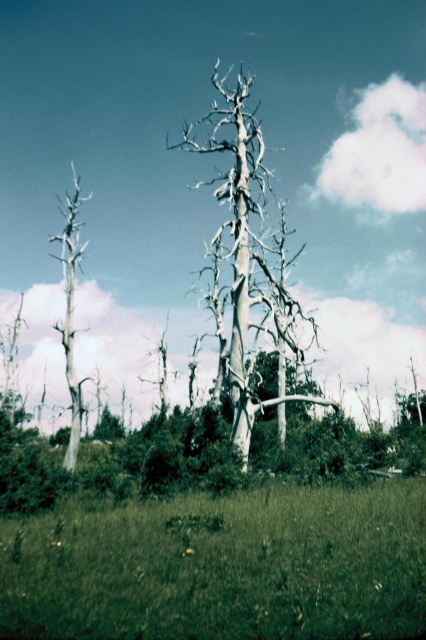
Question: Does green grass at lower center appear under white textured tree at center?

Choices:
 (A) no
 (B) yes

Answer: (B)

Question: Based on their relative distances, which object is farther from the green grass at lower center?

Choices:
 (A) gray bark tree at left
 (B) white textured tree at center

Answer: (A)

Question: Which of these objects is positioned farthest from the gray bark tree at left?

Choices:
 (A) white textured tree at center
 (B) green grass at lower center

Answer: (B)

Question: Does green grass at lower center have a larger size compared to white textured tree at center?

Choices:
 (A) no
 (B) yes

Answer: (A)

Question: Considering the real-world distances, which object is closest to the gray bark tree at left?

Choices:
 (A) white textured tree at center
 (B) green grass at lower center

Answer: (A)

Question: Is white textured tree at center positioned at the back of gray bark tree at left?

Choices:
 (A) no
 (B) yes

Answer: (B)